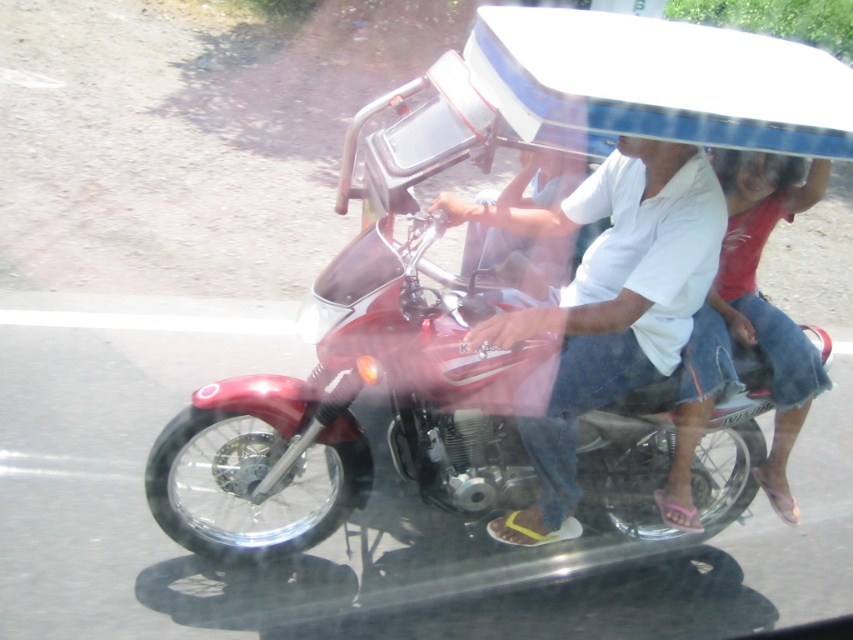
Question: Is metallic red motorcycle at center to the right of denim shorts at center from the viewer's perspective?

Choices:
 (A) yes
 (B) no

Answer: (B)

Question: Among these objects, which one is nearest to the camera?

Choices:
 (A) white cotton shirt at center
 (B) metallic red motorcycle at center
 (C) denim shorts at center

Answer: (A)

Question: Is metallic red motorcycle at center to the right of white cotton shirt at center from the viewer's perspective?

Choices:
 (A) yes
 (B) no

Answer: (B)

Question: Is white cotton shirt at center bigger than denim shorts at center?

Choices:
 (A) no
 (B) yes

Answer: (B)

Question: Which object is closer to the camera taking this photo?

Choices:
 (A) white cotton shirt at center
 (B) metallic red motorcycle at center
 (C) denim shorts at center

Answer: (A)

Question: Which object is positioned farthest from the denim shorts at center?

Choices:
 (A) white cotton shirt at center
 (B) metallic red motorcycle at center

Answer: (B)